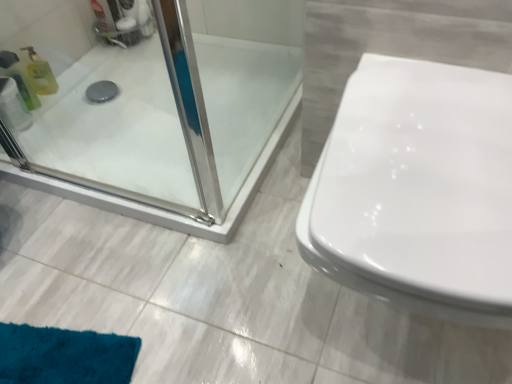
Where is `vacant space to the right of transparent plastic toilet paper at upper left`? Image resolution: width=512 pixels, height=384 pixels. vacant space to the right of transparent plastic toilet paper at upper left is located at coordinates (75, 119).